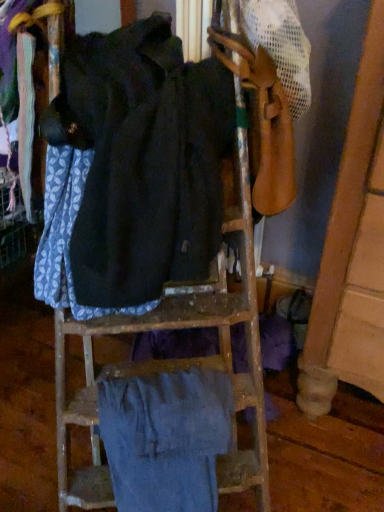
Question: Is denim pants at lower center, which ranks as the 2th wide in top-to-bottom order, oriented away from dark blue fabric at center, the first wide positioned from the top?

Choices:
 (A) no
 (B) yes

Answer: (A)

Question: Is denim pants at lower center, placed as the first wide when sorted from bottom to top, thinner than dark blue fabric at center, the first wide positioned from the top?

Choices:
 (A) yes
 (B) no

Answer: (A)

Question: Does denim pants at lower center, placed as the first wide when sorted from bottom to top, turn towards dark blue fabric at center, which is the 2th wide in bottom-to-top order?

Choices:
 (A) yes
 (B) no

Answer: (B)

Question: Is denim pants at lower center, which ranks as the 2th wide in top-to-bottom order, closer to camera compared to dark blue fabric at center, which is the 2th wide in bottom-to-top order?

Choices:
 (A) no
 (B) yes

Answer: (A)

Question: Considering the relative sizes of denim pants at lower center, which ranks as the 2th wide in top-to-bottom order, and dark blue fabric at center, the first wide positioned from the top, in the image provided, is denim pants at lower center, which ranks as the 2th wide in top-to-bottom order, shorter than dark blue fabric at center, the first wide positioned from the top,?

Choices:
 (A) yes
 (B) no

Answer: (A)

Question: Considering the relative positions of denim pants at lower center, placed as the first wide when sorted from bottom to top, and dark blue fabric at center, the first wide positioned from the top, in the image provided, is denim pants at lower center, placed as the first wide when sorted from bottom to top, to the right of dark blue fabric at center, the first wide positioned from the top, from the viewer's perspective?

Choices:
 (A) yes
 (B) no

Answer: (A)

Question: Is dark blue fabric at center, the first wide positioned from the top, smaller than denim pants at lower center, placed as the first wide when sorted from bottom to top?

Choices:
 (A) no
 (B) yes

Answer: (A)

Question: Is dark blue fabric at center, the first wide positioned from the top, further to the viewer compared to denim pants at lower center, placed as the first wide when sorted from bottom to top?

Choices:
 (A) yes
 (B) no

Answer: (B)

Question: Can you confirm if dark blue fabric at center, which is the 2th wide in bottom-to-top order, is wider than denim pants at lower center, which ranks as the 2th wide in top-to-bottom order?

Choices:
 (A) no
 (B) yes

Answer: (B)

Question: Could you tell me if dark blue fabric at center, which is the 2th wide in bottom-to-top order, is facing denim pants at lower center, placed as the first wide when sorted from bottom to top?

Choices:
 (A) no
 (B) yes

Answer: (A)

Question: Does dark blue fabric at center, the first wide positioned from the top, have a larger size compared to denim pants at lower center, which ranks as the 2th wide in top-to-bottom order?

Choices:
 (A) no
 (B) yes

Answer: (B)

Question: Is dark blue fabric at center, the first wide positioned from the top, touching denim pants at lower center, which ranks as the 2th wide in top-to-bottom order?

Choices:
 (A) no
 (B) yes

Answer: (A)

Question: Do you think dark blue fabric at center, which is the 2th wide in bottom-to-top order, is within denim pants at lower center, which ranks as the 2th wide in top-to-bottom order, or outside of it?

Choices:
 (A) outside
 (B) inside

Answer: (A)